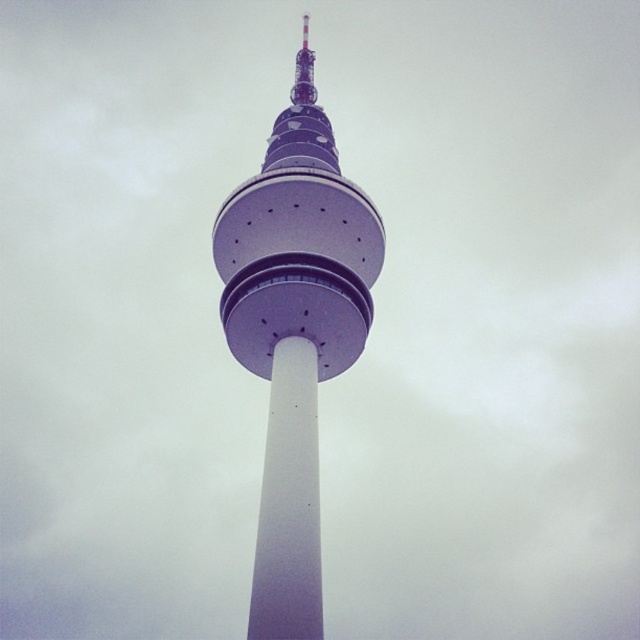
Consider the image. You are a maintenance worker needing to reach the purple metallic tower at center and the white smooth pole at center. Given that your ladder is 10 meters long, can you safely reach both objects with the ladder?

The purple metallic tower at center and white smooth pole at center are 11.14 meters apart. Since the ladder is only 10 meters long, it is not long enough to safely reach both objects.

You are an engineer inspecting the tower structure. You notice the purple metallic tower at center and the white smooth pole at center. Which one has a greater width according to the description?

The purple metallic tower at center has a greater width than the white smooth pole at center.

You are an engineer inspecting the tower structure. You notice two parts of the tower labeled as the purple metallic tower at center and the white smooth pole at center. Which part has a larger size according to the description?

The purple metallic tower at center is bigger than the white smooth pole at center, so the purple metallic tower at center has a larger size.